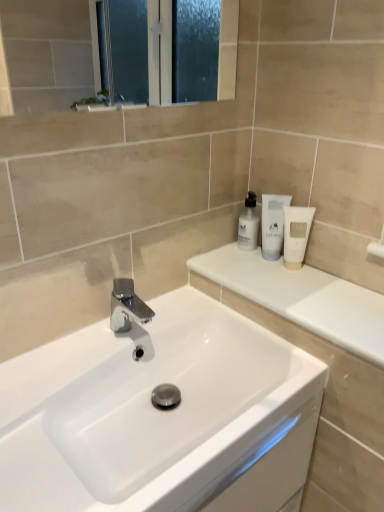
Locate an element on the screen. vacant space in front of white glossy lotion at upper right, which is the 2th toiletry in right-to-left order is located at coordinates (288, 286).